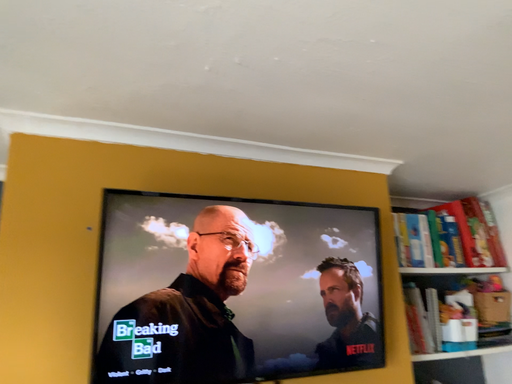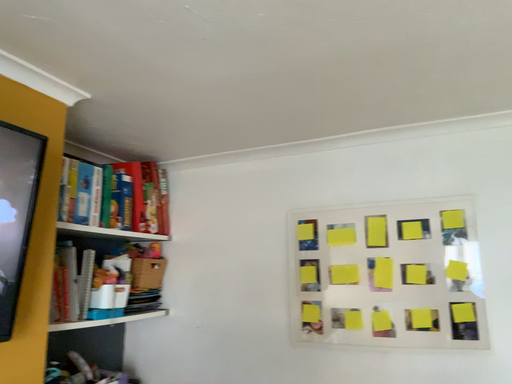
Question: Which way did the camera rotate in the video?

Choices:
 (A) rotated upward
 (B) rotated downward

Answer: (B)